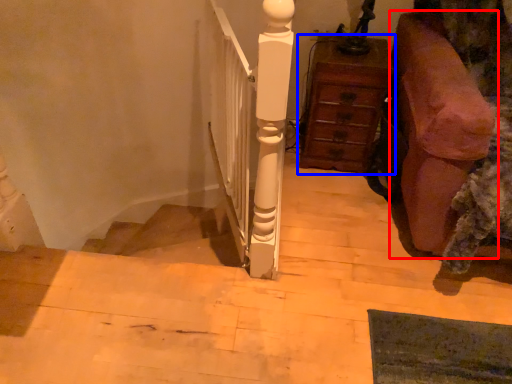
Question: Which object is further to the camera taking this photo, furniture (highlighted by a red box) or chest of drawers (highlighted by a blue box)?

Choices:
 (A) furniture
 (B) chest of drawers

Answer: (B)